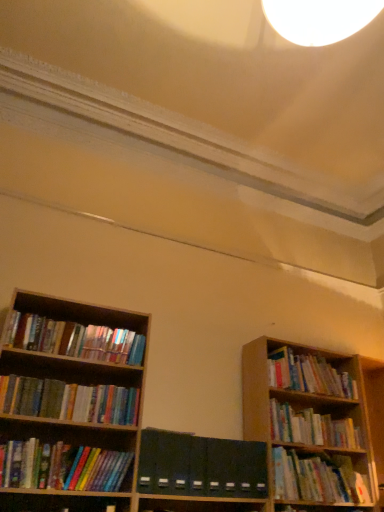
Question: Considering the relative sizes of wooden bookshelf at right, the 1th book viewed from the right, and hardcover books at lower right, which appears as the 4th book when viewed from the left, in the image provided, is wooden bookshelf at right, the 1th book viewed from the right, taller than hardcover books at lower right, which appears as the 4th book when viewed from the left,?

Choices:
 (A) no
 (B) yes

Answer: (B)

Question: Is wooden bookshelf at right, the 1th book viewed from the right, beside hardcover books at lower right, the third book positioned from the right?

Choices:
 (A) no
 (B) yes

Answer: (A)

Question: Does wooden bookshelf at right, which is the 6th book in left-to-right order, have a smaller size compared to hardcover books at lower right, the third book positioned from the right?

Choices:
 (A) yes
 (B) no

Answer: (A)

Question: From the image's perspective, is wooden bookshelf at right, the 1th book viewed from the right, under hardcover books at lower right, which appears as the 4th book when viewed from the left?

Choices:
 (A) yes
 (B) no

Answer: (B)

Question: Would you consider wooden bookshelf at right, which is the 6th book in left-to-right order, to be distant from hardcover books at lower right, which appears as the 4th book when viewed from the left?

Choices:
 (A) yes
 (B) no

Answer: (B)

Question: From a real-world perspective, is wooden bookshelf at right, the 1th book viewed from the right, above or below multicolored paperbacks at left, acting as the first book starting from the left?

Choices:
 (A) above
 (B) below

Answer: (A)

Question: From their relative heights in the image, would you say wooden bookshelf at right, the 1th book viewed from the right, is taller or shorter than multicolored paperbacks at left, which is the 6th book in right-to-left order?

Choices:
 (A) short
 (B) tall

Answer: (B)

Question: Is point (279, 361) closer or farther from the camera than point (61, 411)?

Choices:
 (A) farther
 (B) closer

Answer: (A)

Question: In terms of width, does wooden bookshelf at right, which is the 6th book in left-to-right order, look wider or thinner when compared to multicolored paperbacks at left, acting as the first book starting from the left?

Choices:
 (A) wide
 (B) thin

Answer: (A)

Question: From a real-world perspective, is hardcover books at right, the 2th book positioned from the right, positioned above or below hardcover books at left, the second book viewed from the left?

Choices:
 (A) below
 (B) above

Answer: (A)

Question: Is hardcover books at right, the 2th book positioned from the right, to the left or to the right of hardcover books at left, the second book viewed from the left, in the image?

Choices:
 (A) left
 (B) right

Answer: (B)

Question: Considering their positions, is hardcover books at right, which is the 5th book in left-to-right order, located in front of or behind hardcover books at left, the second book viewed from the left?

Choices:
 (A) front
 (B) behind

Answer: (B)

Question: Based on their sizes in the image, would you say hardcover books at right, the 2th book positioned from the right, is bigger or smaller than hardcover books at left, which ranks as the fifth book in right-to-left order?

Choices:
 (A) small
 (B) big

Answer: (B)

Question: Relative to dark green matte folder at center, is hardcover books at lower right, which appears as the 4th book when viewed from the left, in front or behind?

Choices:
 (A) front
 (B) behind

Answer: (B)

Question: From a real-world perspective, is hardcover books at lower right, which appears as the 4th book when viewed from the left, physically located above or below dark green matte folder at center?

Choices:
 (A) below
 (B) above

Answer: (A)